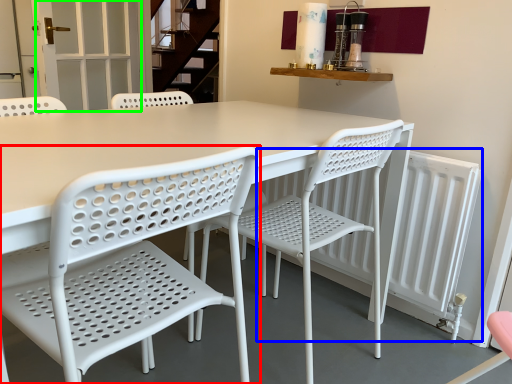
Question: Considering the real-world distances, which object is farthest from chair (highlighted by a red box)? radiator (highlighted by a blue box) or screen door (highlighted by a green box)?

Choices:
 (A) radiator
 (B) screen door

Answer: (B)